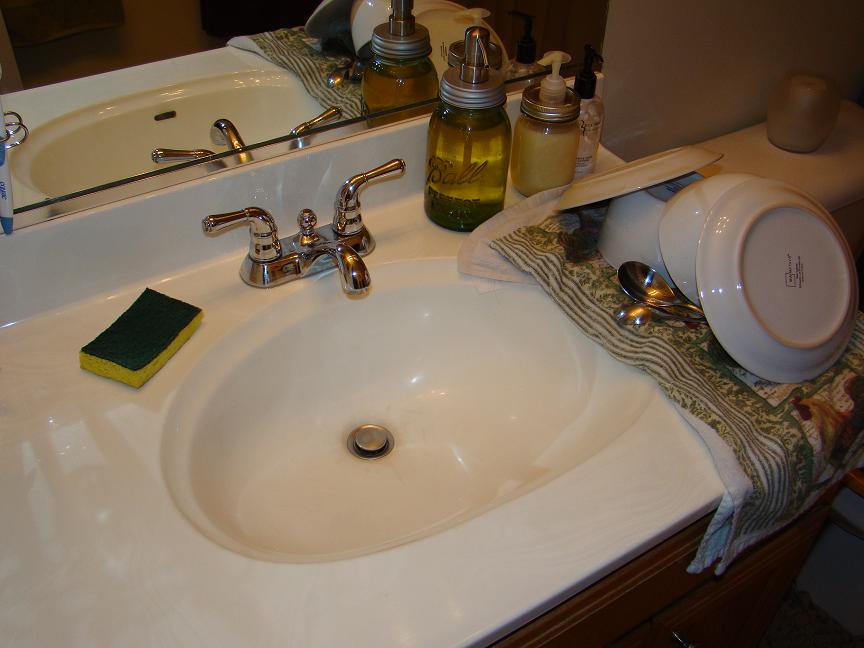
I want to click on counter, so click(x=626, y=505).